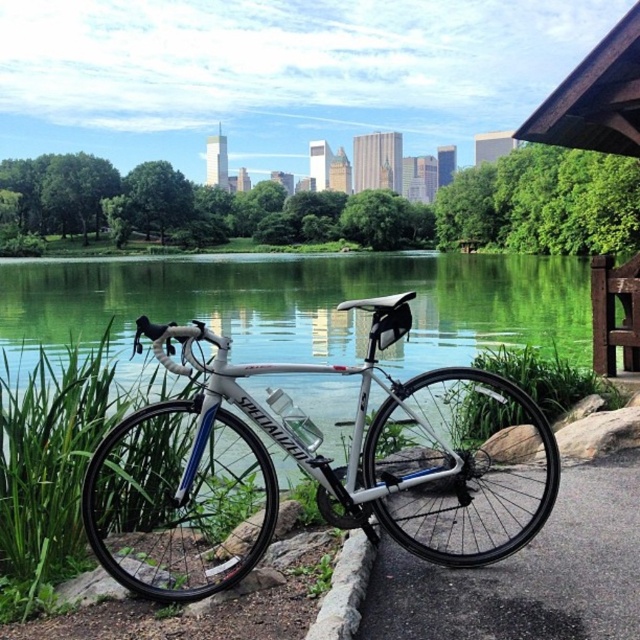
Question: Which of the following is the farthest from the observer?

Choices:
 (A) brown wooden bench at right
 (B) white metallic bicycle at center

Answer: (A)

Question: Is black asphalt pavement at lower right positioned in front of brown wooden bench at right?

Choices:
 (A) no
 (B) yes

Answer: (B)

Question: Among these objects, which one is farthest from the camera?

Choices:
 (A) white metallic bicycle at center
 (B) black asphalt pavement at lower right

Answer: (A)

Question: Considering the real-world distances, which object is farthest from the white metallic bicycle at center?

Choices:
 (A) brown wooden bench at right
 (B) black asphalt pavement at lower right

Answer: (A)

Question: Does black asphalt pavement at lower right have a larger size compared to brown wooden bench at right?

Choices:
 (A) yes
 (B) no

Answer: (A)

Question: Can you confirm if white metallic bicycle at center is positioned to the left of black asphalt pavement at lower right?

Choices:
 (A) yes
 (B) no

Answer: (A)